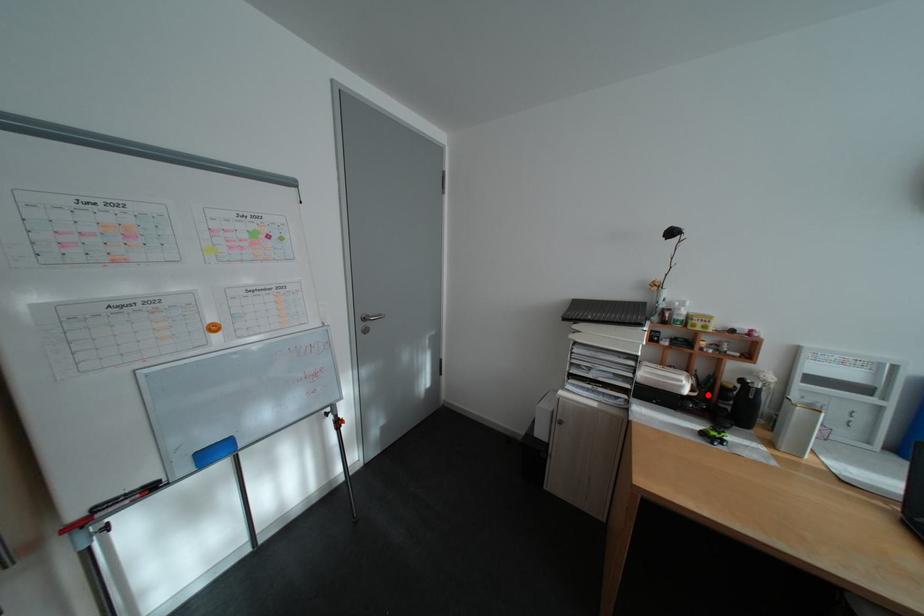
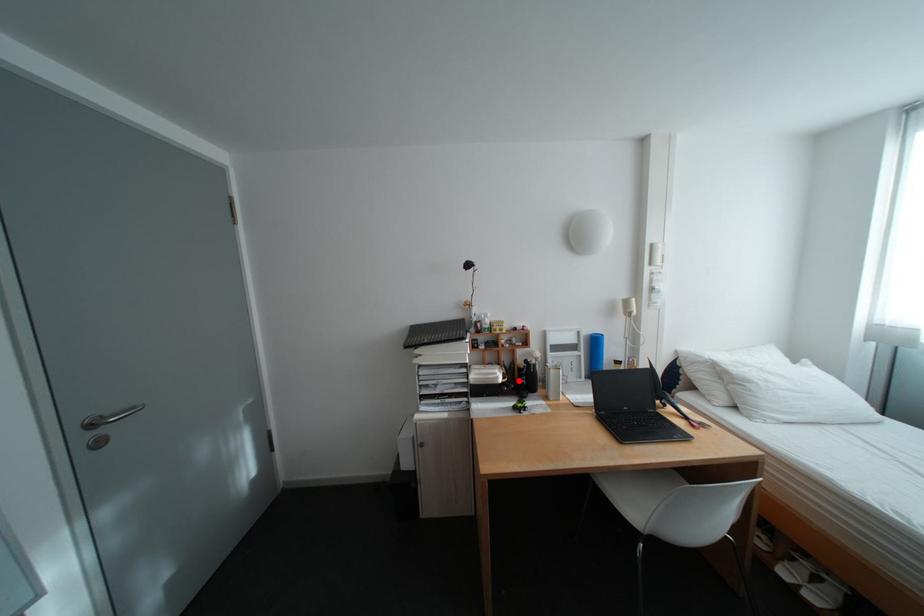
I am providing you with two images of the same scene from different viewpoints. A red point is marked on the first image and another point is marked on the second image. Do the highlighted points in image1 and image2 indicate the same real-world spot?

Yes